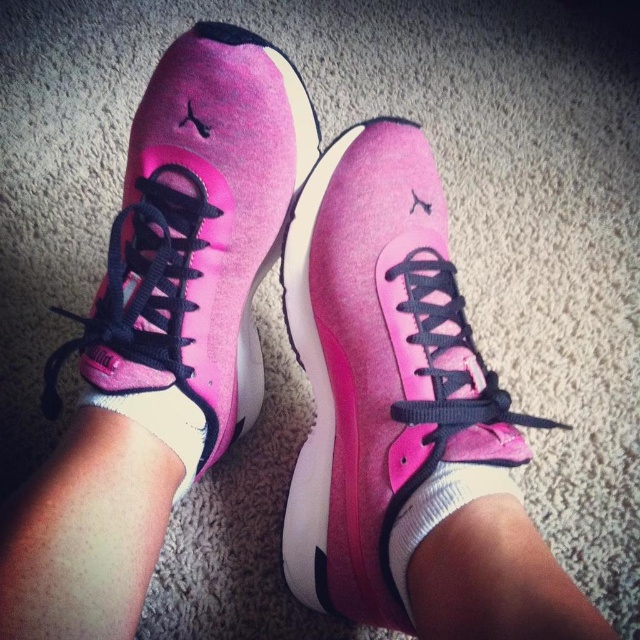
Question: Among these objects, which one is nearest to the camera?

Choices:
 (A) suede pink sneaker at center
 (B) white cotton sock at center
 (C) pink suede sneaker at center

Answer: (C)

Question: Is pink suede sneaker at center to the right of white cotton sock at center from the viewer's perspective?

Choices:
 (A) yes
 (B) no

Answer: (A)

Question: Is suede pink sneaker at center positioned at the back of white cotton sock at center?

Choices:
 (A) no
 (B) yes

Answer: (B)

Question: Which point is farther to the camera?

Choices:
 (A) white soft sock at lower center
 (B) pink suede sneaker at center
 (C) white cotton sock at center

Answer: (C)

Question: Can you confirm if pink suede sneaker at center is positioned to the right of white soft sock at lower center?

Choices:
 (A) no
 (B) yes

Answer: (A)

Question: Considering the real-world distances, which object is farthest from the suede pink sneaker at center?

Choices:
 (A) pink suede sneaker at center
 (B) white cotton sock at center
 (C) white soft sock at lower center

Answer: (C)